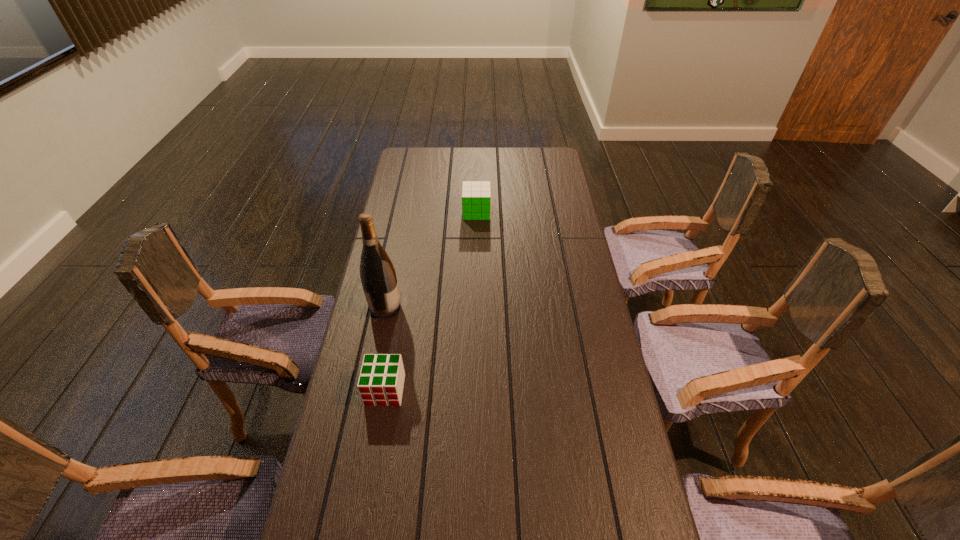
Where is `the tallest object`? the tallest object is located at coordinates (378, 277).

In order to click on wine bottle in this screenshot , I will do `click(378, 277)`.

The width and height of the screenshot is (960, 540). I want to click on the farther cube, so click(x=476, y=196).

You are a GUI agent. You are given a task and a screenshot of the screen. Output one action in this format:
    pyautogui.click(x=<x>, y=<y>)
    Task: Click on the right cube
    Image resolution: width=960 pixels, height=540 pixels.
    Given the screenshot: What is the action you would take?
    pyautogui.click(x=476, y=196)

Find the location of a particular element. The height and width of the screenshot is (540, 960). the left cube is located at coordinates (381, 381).

You are a GUI agent. You are given a task and a screenshot of the screen. Output one action in this format:
    pyautogui.click(x=<x>, y=<y>)
    Task: Click on the nearer cube
    Image resolution: width=960 pixels, height=540 pixels.
    Given the screenshot: What is the action you would take?
    tap(381, 381)

You are a GUI agent. You are given a task and a screenshot of the screen. Output one action in this format:
    pyautogui.click(x=<x>, y=<y>)
    Task: Click on the vacant point located 0.130m on the label of the second nearest object
    This screenshot has height=540, width=960.
    Given the screenshot: What is the action you would take?
    pyautogui.click(x=442, y=307)

The image size is (960, 540). What are the coordinates of `free region located on the right of the farther cube` in the screenshot? It's located at (541, 212).

Where is `vacant space located 0.320m on the red face of the nearest object`? Image resolution: width=960 pixels, height=540 pixels. vacant space located 0.320m on the red face of the nearest object is located at coordinates (360, 539).

This screenshot has height=540, width=960. I want to click on wine bottle that is at the left edge, so click(378, 277).